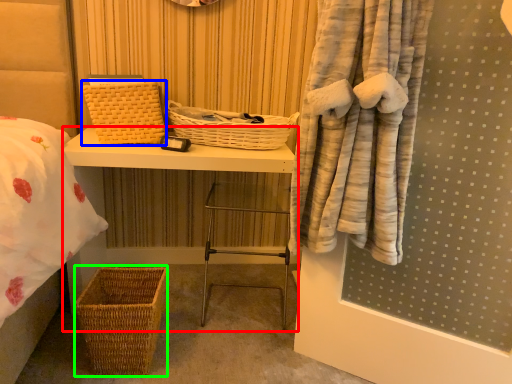
Question: Based on their relative distances, which object is farther from furniture (highlighted by a red box)? Choose from basket (highlighted by a blue box) and basket (highlighted by a green box).

Choices:
 (A) basket
 (B) basket

Answer: (B)